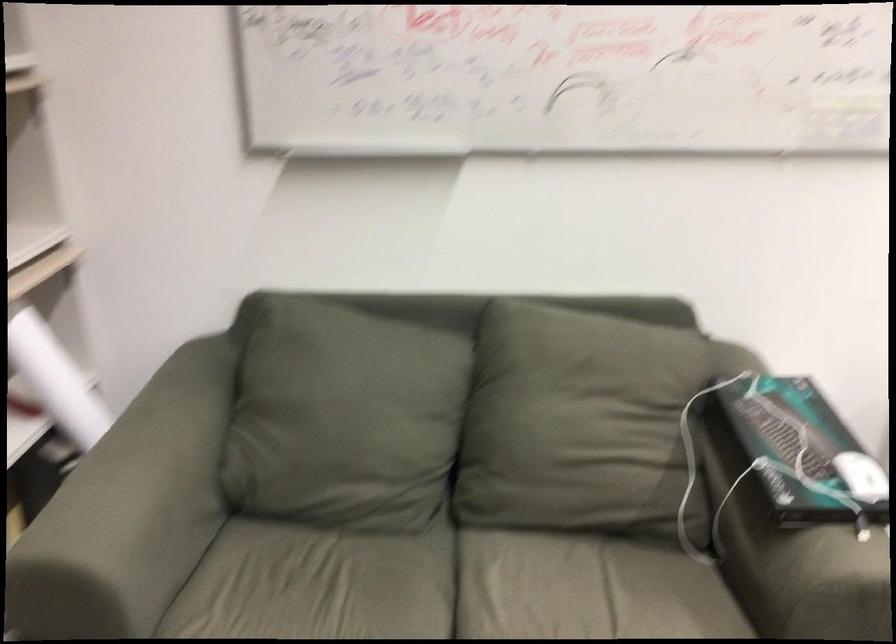
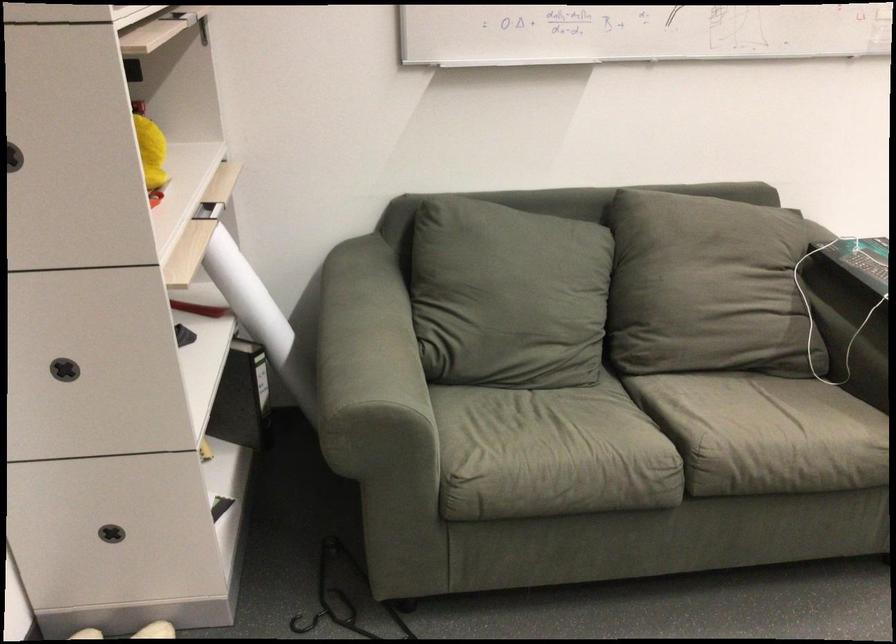
In the second image, find the point that corresponds to point (115, 471) in the first image.

(358, 342)